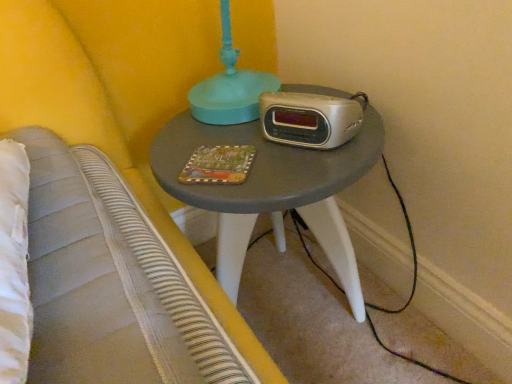
Image resolution: width=512 pixels, height=384 pixels. What are the coordinates of `free space to the right of matte painted wood book at center` in the screenshot? It's located at (301, 153).